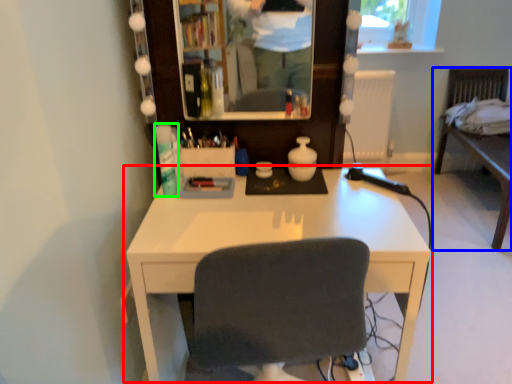
Question: Which object is positioned closest to desk (highlighted by a red box)? Select from furniture (highlighted by a blue box) and toiletry (highlighted by a green box).

Choices:
 (A) furniture
 (B) toiletry

Answer: (B)